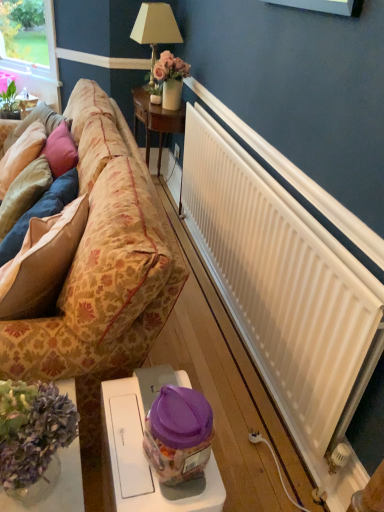
Question: From a real-world perspective, does velvet beige pillow at left, which appears as the 3th pillow when viewed from the right, stand above white matte radiator at right?

Choices:
 (A) no
 (B) yes

Answer: (B)

Question: Is velvet beige pillow at left, placed as the 1th pillow when sorted from left to right, not inside white matte radiator at right?

Choices:
 (A) yes
 (B) no

Answer: (A)

Question: Is velvet beige pillow at left, which appears as the 3th pillow when viewed from the right, closer to camera compared to white matte radiator at right?

Choices:
 (A) no
 (B) yes

Answer: (A)

Question: Considering the relative sizes of velvet beige pillow at left, placed as the 1th pillow when sorted from left to right, and white matte radiator at right in the image provided, is velvet beige pillow at left, placed as the 1th pillow when sorted from left to right, shorter than white matte radiator at right?

Choices:
 (A) no
 (B) yes

Answer: (B)

Question: From a real-world perspective, is velvet beige pillow at left, placed as the 1th pillow when sorted from left to right, beneath white matte radiator at right?

Choices:
 (A) no
 (B) yes

Answer: (A)

Question: Could you tell me if velvet beige pillow at left, which appears as the 3th pillow when viewed from the right, is turned towards white matte radiator at right?

Choices:
 (A) no
 (B) yes

Answer: (A)

Question: From the image's perspective, would you say floral-patterned fabric couch at left is positioned over clear glass vase at lower left, arranged as the 1th table when ordered from the bottom?

Choices:
 (A) yes
 (B) no

Answer: (A)

Question: Does floral-patterned fabric couch at left have a lesser width compared to clear glass vase at lower left, arranged as the 1th table when ordered from the bottom?

Choices:
 (A) yes
 (B) no

Answer: (B)

Question: Is floral-patterned fabric couch at left positioned far away from clear glass vase at lower left, placed as the second table when sorted from front to back?

Choices:
 (A) yes
 (B) no

Answer: (B)

Question: Is floral-patterned fabric couch at left taller than clear glass vase at lower left, which is counted as the 2th table, starting from the back?

Choices:
 (A) yes
 (B) no

Answer: (A)

Question: From a real-world perspective, is floral-patterned fabric couch at left under clear glass vase at lower left, acting as the third table starting from the top?

Choices:
 (A) yes
 (B) no

Answer: (B)

Question: Can you confirm if floral-patterned fabric couch at left is smaller than clear glass vase at lower left, which is counted as the 2th table, starting from the back?

Choices:
 (A) yes
 (B) no

Answer: (B)

Question: Would you consider suede-like beige pillow at left, the 3th pillow positioned from the left, to be distant from floral-patterned fabric couch at left?

Choices:
 (A) yes
 (B) no

Answer: (B)